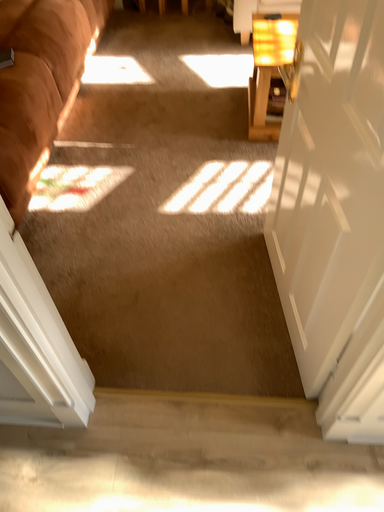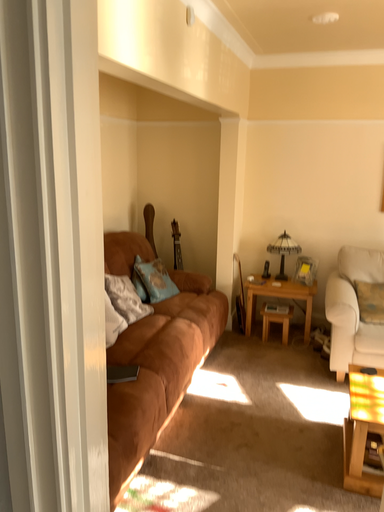
Question: How did the camera likely rotate when shooting the video?

Choices:
 (A) rotated right
 (B) rotated left

Answer: (B)